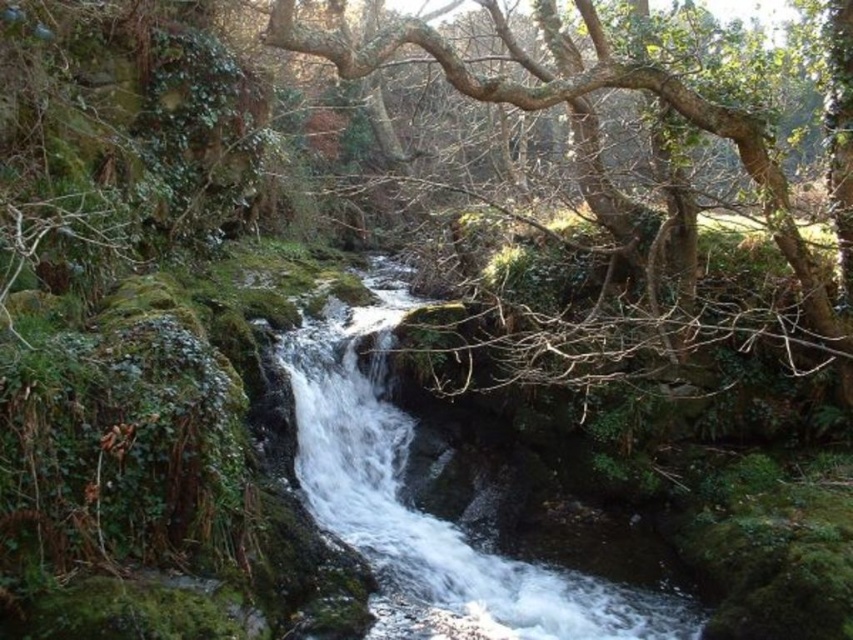
Can you confirm if white frothy water at center is taller than green leafy tree at center?

Yes.

This screenshot has width=853, height=640. What do you see at coordinates (440, 506) in the screenshot?
I see `white frothy water at center` at bounding box center [440, 506].

Is point (312, 464) farther from viewer compared to point (280, 20)?

Yes, point (312, 464) is behind point (280, 20).

Image resolution: width=853 pixels, height=640 pixels. Identify the location of white frothy water at center. (440, 506).